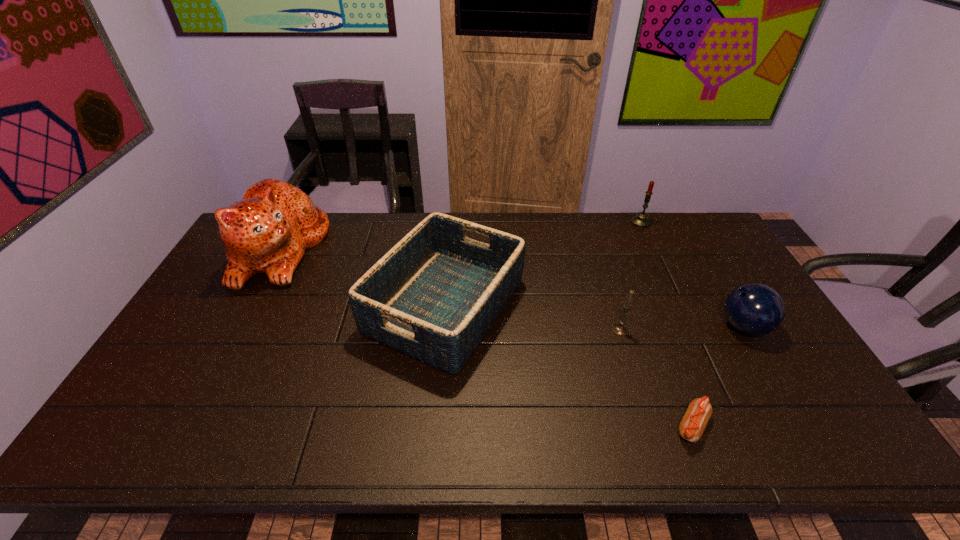
You are a GUI agent. You are given a task and a screenshot of the screen. Output one action in this format:
    pyautogui.click(x=<x>, y=<y>)
    Task: Click on the vacant space situated 0.340m on the face of the cat
    This screenshot has height=540, width=960.
    Given the screenshot: What is the action you would take?
    pyautogui.click(x=421, y=249)

At what (x,y) coordinates should I click in order to perform the action: click on vacant space situated on the left of the right candle. Please return your answer as a coordinate pair (x, y). The height and width of the screenshot is (540, 960). Looking at the image, I should click on [615, 222].

In order to click on vacant position located 0.060m on the right of the second object from left to right in this screenshot , I will do `click(545, 306)`.

Locate an element on the screen. The height and width of the screenshot is (540, 960). vacant region located on the right of the left candle is located at coordinates (741, 330).

Locate an element on the screen. Image resolution: width=960 pixels, height=540 pixels. vacant area situated on the surface of the bowling ball near the finger holes is located at coordinates (666, 327).

Where is `vacant space located on the surface of the bowling ball near the finger holes`? The height and width of the screenshot is (540, 960). vacant space located on the surface of the bowling ball near the finger holes is located at coordinates (635, 327).

You are a GUI agent. You are given a task and a screenshot of the screen. Output one action in this format:
    pyautogui.click(x=<x>, y=<y>)
    Task: Click on the free spot located 0.230m on the surface of the bowling ball near the finger holes
    
    Given the screenshot: What is the action you would take?
    pyautogui.click(x=638, y=327)

Locate an element on the screen. free region located 0.310m on the right of the fourth object from left to right is located at coordinates [x=845, y=426].

Find the location of a particular element. cat at the far edge is located at coordinates [x=267, y=232].

Find the location of a particular element. candle positioned at the far edge is located at coordinates (641, 220).